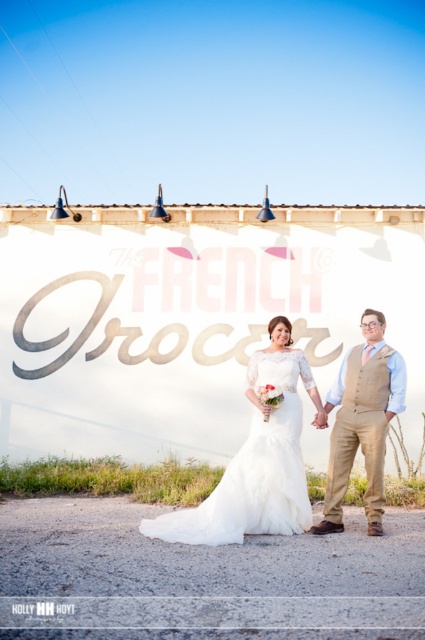
Question: Which point appears farthest from the camera in this image?

Choices:
 (A) (382, 499)
 (B) (204, 515)

Answer: (A)

Question: Which point is farther to the camera?

Choices:
 (A) (380, 524)
 (B) (204, 508)

Answer: (A)

Question: Can you confirm if white satin dress at center is positioned to the left of tan fabric vest at center?

Choices:
 (A) no
 (B) yes

Answer: (B)

Question: Does white satin dress at center appear on the left side of tan fabric vest at center?

Choices:
 (A) no
 (B) yes

Answer: (B)

Question: Does white satin dress at center appear on the left side of tan fabric vest at center?

Choices:
 (A) no
 (B) yes

Answer: (B)